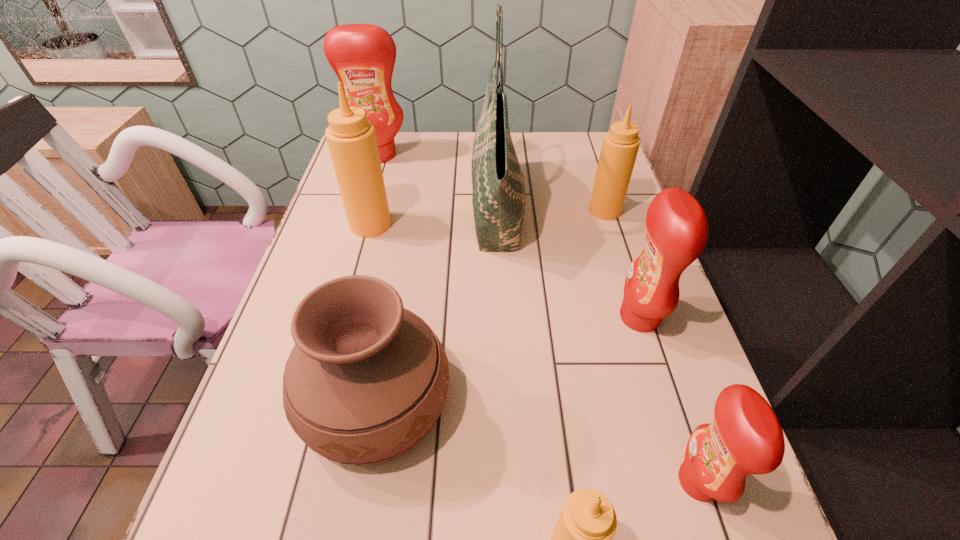
The height and width of the screenshot is (540, 960). What are the coordinates of `red condiment that is the second closest to the nearest condiment` in the screenshot? It's located at (677, 231).

What are the coordinates of `tan condiment that is the third closest to the leftmost red condiment` in the screenshot? It's located at (581, 539).

Choose which tan condiment is the third nearest neighbor to the smallest red condiment. Please provide its 2D coordinates. Your answer should be formatted as a tuple, i.e. [(x, y)], where the tuple contains the x and y coordinates of a point satisfying the conditions above.

[(351, 139)]

In order to click on free space that satisfies the following two spatial constraints: 1. on the label side of the tote bag; 2. on the right side of the farthest condiment in this screenshot , I will do `click(363, 208)`.